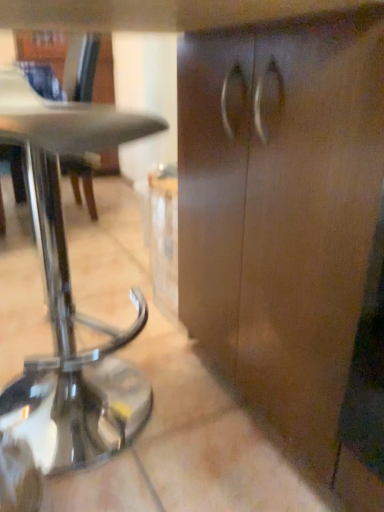
Image resolution: width=384 pixels, height=512 pixels. Find the location of `free space to the back side of shiny metallic table at left`. free space to the back side of shiny metallic table at left is located at coordinates (95, 320).